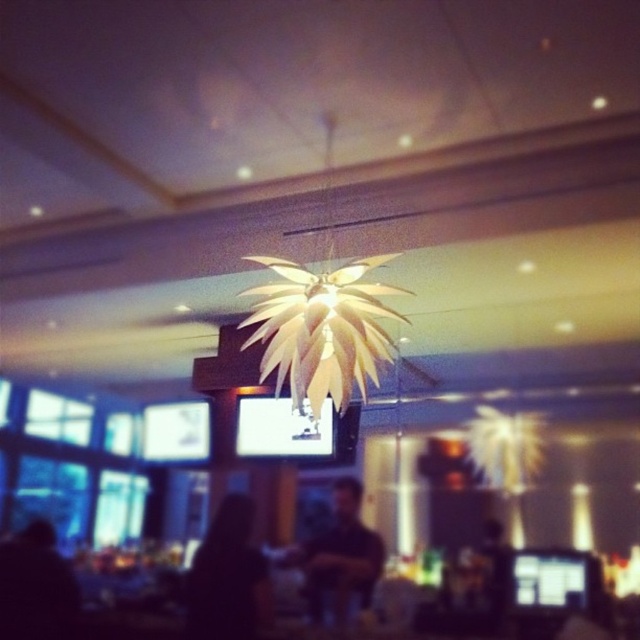
Is point (256, 596) positioned before point (328, 534)?

Yes, it is.

Does black matte person at lower center have a greater width compared to black matte shirt at center?

Correct, the width of black matte person at lower center exceeds that of black matte shirt at center.

Who is more distant from viewer, [259,588] or [308,598]?

Point [259,588]

At what (x,y) coordinates should I click in order to perform the action: click on black matte person at lower center. Please return your answer as a coordinate pair (x, y). The width and height of the screenshot is (640, 640). Looking at the image, I should click on (228, 577).

Between point (314, 324) and point (337, 605), which one is positioned in front?

Point (314, 324) is more forward.

Can you confirm if matte gold leaf chandelier at center is positioned below black matte shirt at center?

No.

Locate an element on the screen. matte gold leaf chandelier at center is located at coordinates (323, 328).

What do you see at coordinates (323, 328) in the screenshot? Image resolution: width=640 pixels, height=640 pixels. I see `matte gold leaf chandelier at center` at bounding box center [323, 328].

Does point (317, 365) come behind point (52, 545)?

No.

Does point (362, 269) come in front of point (28, 525)?

Yes, point (362, 269) is closer to viewer.

The height and width of the screenshot is (640, 640). Find the location of `matte gold leaf chandelier at center`. matte gold leaf chandelier at center is located at coordinates (323, 328).